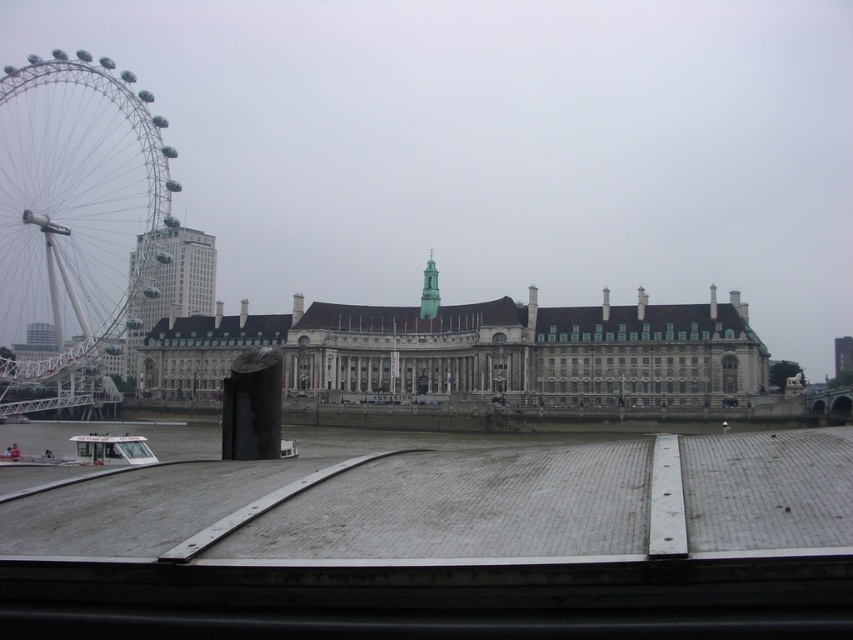
From the picture: You are standing at the point marked by the coordinates point (502, 147). Looking around, you see the London Eye Ferris wheel on the left side of the frame. What direction should you face to see the matte gray sky at upper center?

The point (502, 147) marks the matte gray sky at upper center, so facing upwards would allow you to see the matte gray sky at upper center.

You are a photographer planning to take a landscape shot of the matte gray sky at upper center and the stone building at center. Which object will occupy more vertical space in the photo?

The matte gray sky at upper center is taller than the stone building at center, so it will occupy more vertical space in the photo.